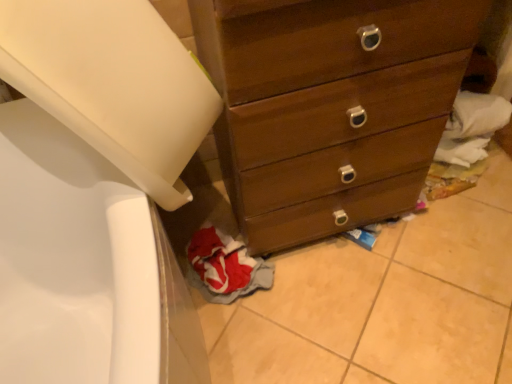
Question: From the image's perspective, does wooden chest of drawers at center appear higher than red fabric clothes at lower left?

Choices:
 (A) yes
 (B) no

Answer: (A)

Question: Is wooden chest of drawers at center thinner than red fabric clothes at lower left?

Choices:
 (A) yes
 (B) no

Answer: (B)

Question: Does wooden chest of drawers at center have a larger size compared to red fabric clothes at lower left?

Choices:
 (A) yes
 (B) no

Answer: (A)

Question: Is red fabric clothes at lower left inside wooden chest of drawers at center?

Choices:
 (A) yes
 (B) no

Answer: (B)

Question: Considering the relative sizes of wooden chest of drawers at center and red fabric clothes at lower left in the image provided, is wooden chest of drawers at center smaller than red fabric clothes at lower left?

Choices:
 (A) yes
 (B) no

Answer: (B)

Question: Is wooden chest of drawers at center taller than red fabric clothes at lower left?

Choices:
 (A) no
 (B) yes

Answer: (B)

Question: From a real-world perspective, does red fabric clothes at lower left sit lower than wooden chest of drawers at center?

Choices:
 (A) no
 (B) yes

Answer: (B)

Question: Would you say red fabric clothes at lower left is outside wooden chest of drawers at center?

Choices:
 (A) yes
 (B) no

Answer: (A)

Question: Is red fabric clothes at lower left thinner than wooden chest of drawers at center?

Choices:
 (A) yes
 (B) no

Answer: (A)

Question: Is red fabric clothes at lower left beside wooden chest of drawers at center?

Choices:
 (A) no
 (B) yes

Answer: (A)

Question: Considering the relative sizes of red fabric clothes at lower left and wooden chest of drawers at center in the image provided, is red fabric clothes at lower left bigger than wooden chest of drawers at center?

Choices:
 (A) yes
 (B) no

Answer: (B)

Question: Is red fabric clothes at lower left turned away from wooden chest of drawers at center?

Choices:
 (A) no
 (B) yes

Answer: (A)

Question: Do you think wooden chest of drawers at center is within red fabric clothes at lower left, or outside of it?

Choices:
 (A) outside
 (B) inside

Answer: (A)